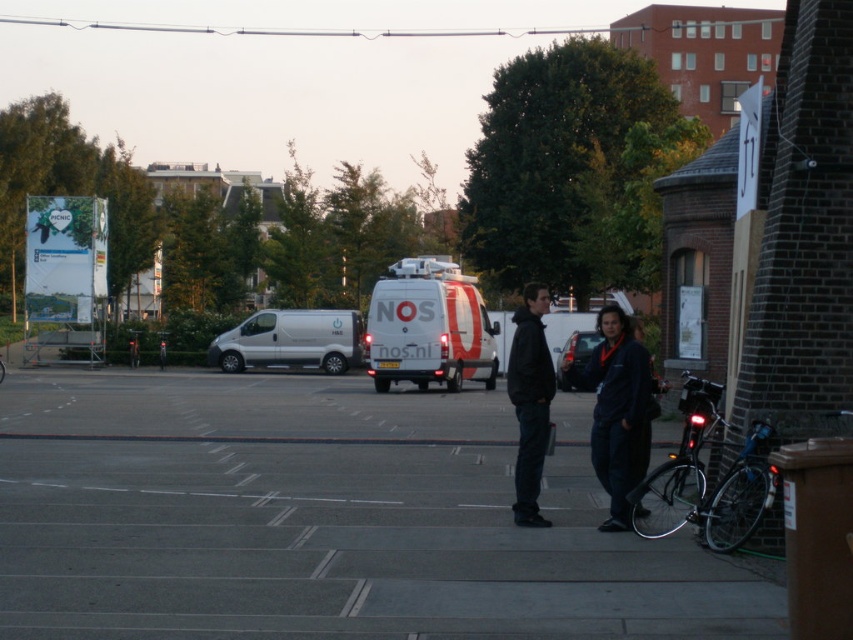
Is gray concrete parking lot at center above dark blue jacket at center?

Incorrect, gray concrete parking lot at center is not positioned above dark blue jacket at center.

Describe the element at coordinates (323, 518) in the screenshot. I see `gray concrete parking lot at center` at that location.

Locate an element on the screen. Image resolution: width=853 pixels, height=640 pixels. gray concrete parking lot at center is located at coordinates (323, 518).

At what (x,y) coordinates should I click in order to perform the action: click on dark blue jacket at center. Please return your answer as a coordinate pair (x, y). The height and width of the screenshot is (640, 853). Looking at the image, I should click on (618, 410).

What do you see at coordinates (618, 410) in the screenshot?
I see `dark blue jacket at center` at bounding box center [618, 410].

Locate an element on the screen. This screenshot has height=640, width=853. dark blue jacket at center is located at coordinates (618, 410).

Is silver metallic van at center wider than metallic silver van at center?

Indeed, silver metallic van at center has a greater width compared to metallic silver van at center.

Can you confirm if silver metallic van at center is taller than metallic silver van at center?

Correct, silver metallic van at center is much taller as metallic silver van at center.

Consider the image. Who is more distant from viewer, (310, 308) or (577, 371)?

The point (310, 308) is more distant.

At what (x,y) coordinates should I click in order to perform the action: click on silver metallic van at center. Please return your answer as a coordinate pair (x, y). The width and height of the screenshot is (853, 640). Looking at the image, I should click on (291, 340).